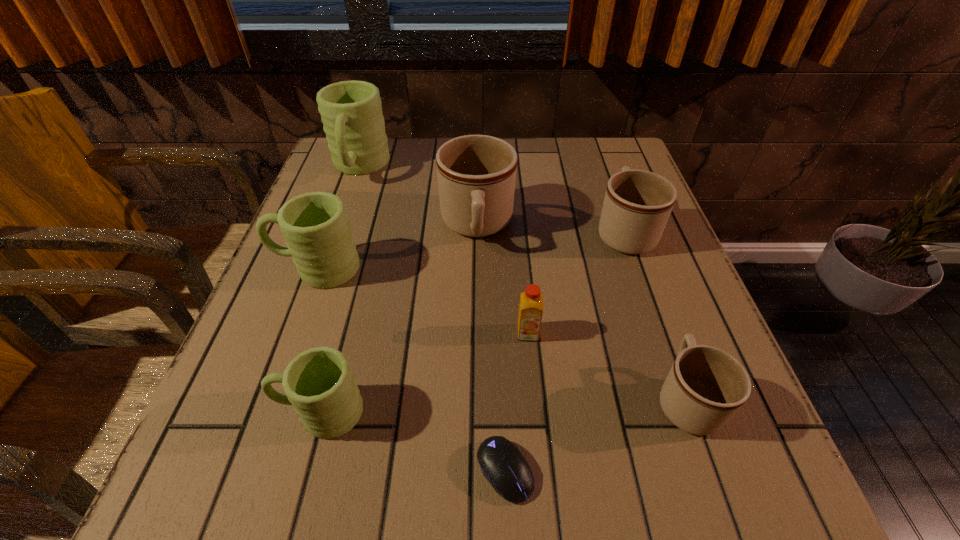
In order to click on free location at the far left corner of the desktop in this screenshot , I will do `click(334, 183)`.

Image resolution: width=960 pixels, height=540 pixels. In the image, there is a desktop. Find the location of `free space at the far right corner`. free space at the far right corner is located at coordinates (598, 172).

This screenshot has height=540, width=960. Identify the location of free space at the near right corner. (694, 470).

Find the location of a particular element. Image resolution: width=960 pixels, height=540 pixels. vacant space that's between the second nearest green mug and the second biggest brown mug is located at coordinates (470, 250).

This screenshot has height=540, width=960. I want to click on vacant area between the third mug from right to left and the farthest mug, so click(x=419, y=197).

Locate an element on the screen. The width and height of the screenshot is (960, 540). vacant space that is in between the third mug from right to left and the smallest green mug is located at coordinates (398, 319).

Locate an element on the screen. The image size is (960, 540). empty space that is in between the biggest green mug and the black computer mouse is located at coordinates (432, 319).

Identify the location of vacant region between the nearest brown mug and the second biggest brown mug. Image resolution: width=960 pixels, height=540 pixels. (656, 315).

Locate an element on the screen. blank region between the farthest object and the fifth farthest object is located at coordinates (444, 250).

Where is `free space between the computer mouse and the fourth mug from left to right`? Image resolution: width=960 pixels, height=540 pixels. free space between the computer mouse and the fourth mug from left to right is located at coordinates (491, 349).